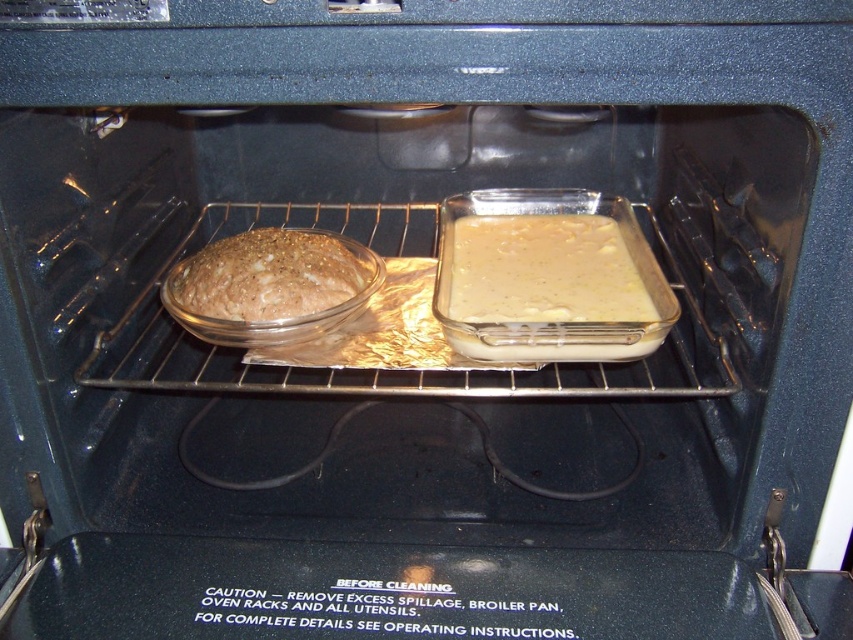
Between yellow matte cake at center and brown matte bread at center, which one has less height?

Standing shorter between the two is brown matte bread at center.

From the picture: Can you confirm if yellow matte cake at center is thinner than brown matte bread at center?

Incorrect, yellow matte cake at center's width is not less than brown matte bread at center's.

At what (x,y) coordinates should I click in order to perform the action: click on yellow matte cake at center. Please return your answer as a coordinate pair (x, y). The image size is (853, 640). Looking at the image, I should click on (543, 272).